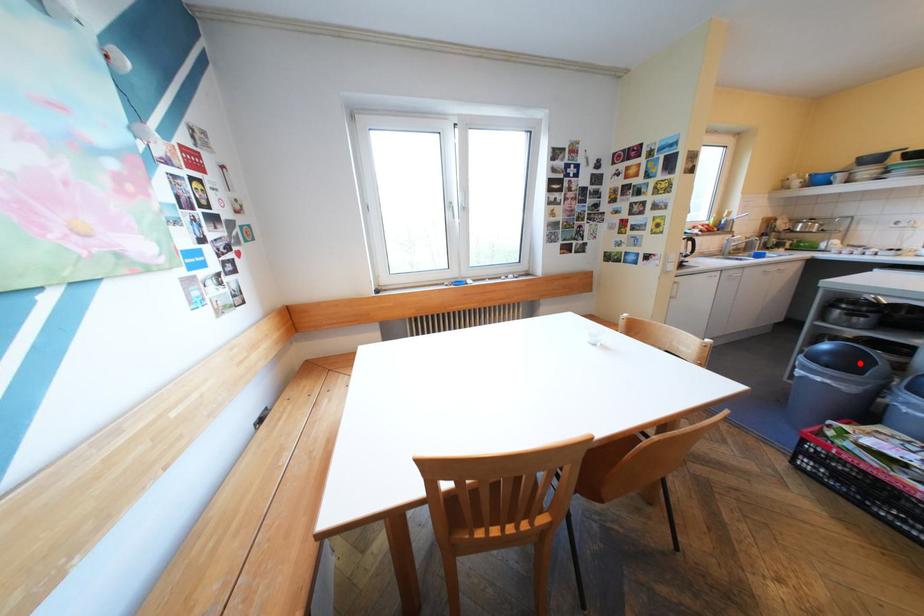
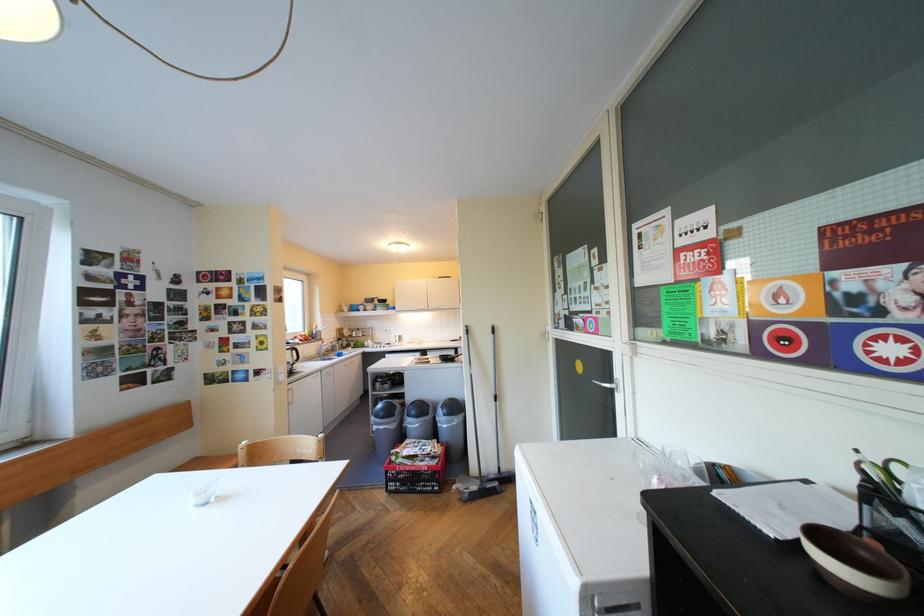
Question: I am providing you with two images of the same scene from different viewpoints. A red point is shown in image1. For the corresponding object point in image2, is it positioned nearer or farther from the camera?

Choices:
 (A) Nearer
 (B) Farther

Answer: (B)